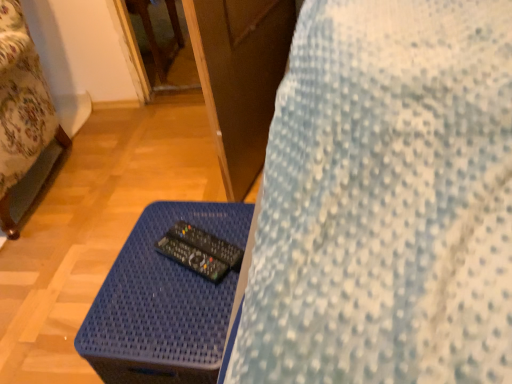
What are the coordinates of `unoccupied space behind black plastic remote at center, acting as the 2th control starting from the bottom` in the screenshot? It's located at (199, 220).